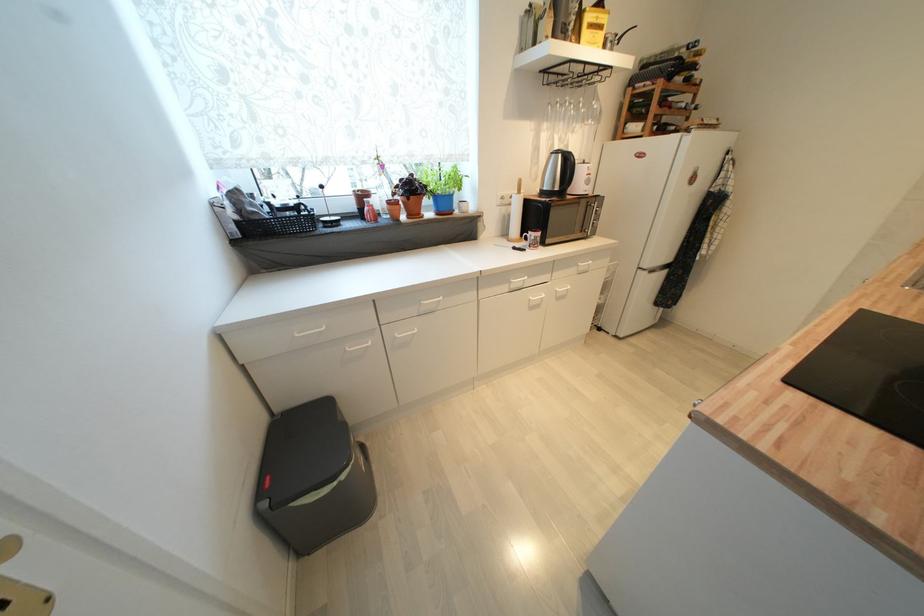
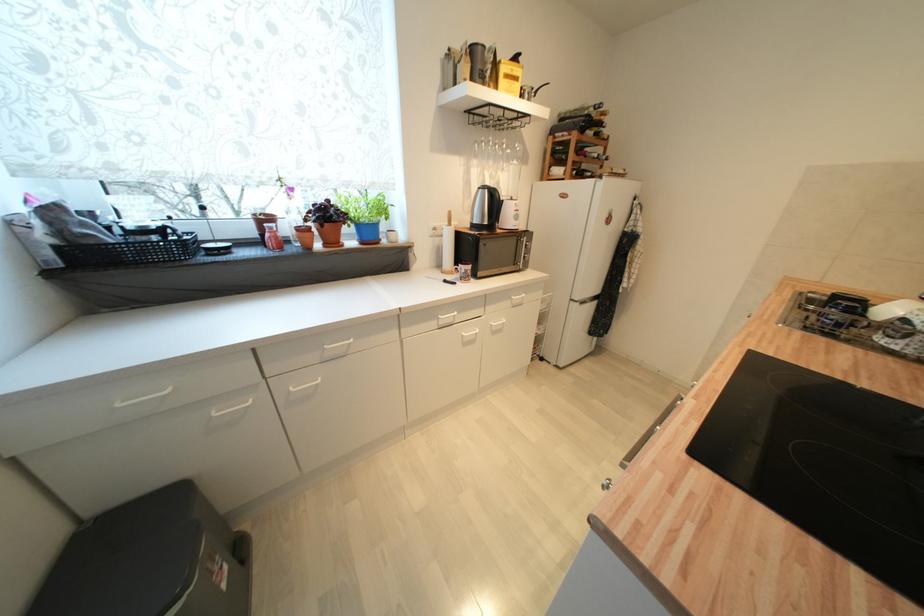
Locate, in the second image, the point that corresponds to point 589,164 in the first image.

(517, 201)